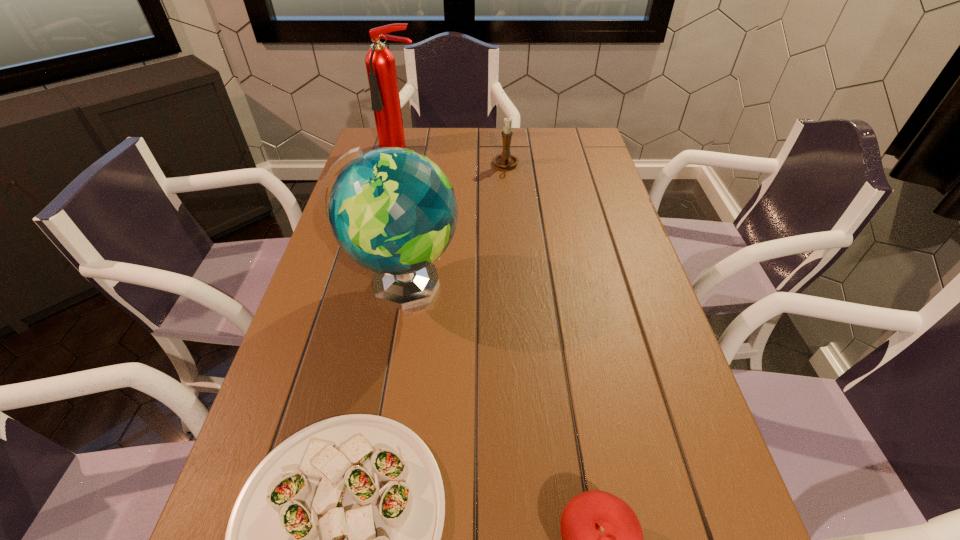
Locate an element on the screen. The height and width of the screenshot is (540, 960). fire extinguisher is located at coordinates (380, 63).

Where is `globe`? The image size is (960, 540). globe is located at coordinates (393, 211).

At what (x,y) coordinates should I click in order to perform the action: click on the third tallest object. Please return your answer as a coordinate pair (x, y). Looking at the image, I should click on (505, 160).

You are a GUI agent. You are given a task and a screenshot of the screen. Output one action in this format:
    pyautogui.click(x=<x>, y=<y>)
    Task: Click on the free space located 0.060m at the nozzle of the fire extinguisher
    
    Given the screenshot: What is the action you would take?
    pyautogui.click(x=396, y=169)

Where is `vacant space located on the front surface of the globe`? vacant space located on the front surface of the globe is located at coordinates (578, 285).

This screenshot has height=540, width=960. Find the location of `free space located on the side of the candle holder with the handle`. free space located on the side of the candle holder with the handle is located at coordinates (513, 249).

You are a GUI agent. You are given a task and a screenshot of the screen. Output one action in this format:
    pyautogui.click(x=<x>, y=<y>)
    Task: Click on the fire extinguisher that is at the far edge
    This screenshot has height=540, width=960.
    Given the screenshot: What is the action you would take?
    pyautogui.click(x=380, y=63)

Locate an element on the screen. The width and height of the screenshot is (960, 540). candle holder situated at the far edge is located at coordinates (505, 160).

Where is `fire extinguisher present at the left edge`? The image size is (960, 540). fire extinguisher present at the left edge is located at coordinates point(380,63).

Where is `globe that is positioned at the left edge`? globe that is positioned at the left edge is located at coordinates (393, 211).